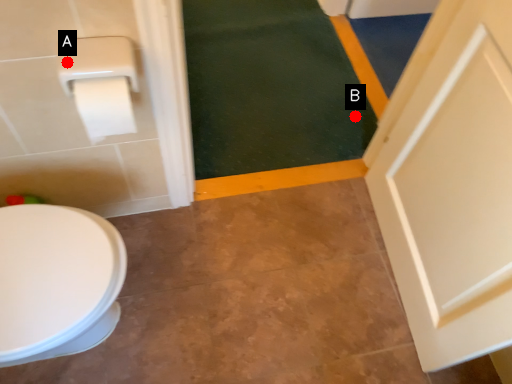
Question: Two points are circled on the image, labeled by A and B beside each circle. Which point is farther from the camera taking this photo?

Choices:
 (A) A is further
 (B) B is further

Answer: (B)